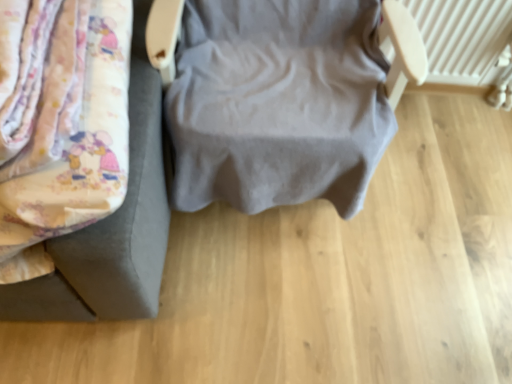
Question: From the image's perspective, is gray fabric chair at center, which is counted as the second furniture, starting from the left, located beneath fluffy fabric bed at left, which is the first furniture in left-to-right order?

Choices:
 (A) yes
 (B) no

Answer: (B)

Question: Considering the relative sizes of gray fabric chair at center, which is counted as the second furniture, starting from the left, and fluffy fabric bed at left, which is the first furniture in left-to-right order, in the image provided, is gray fabric chair at center, which is counted as the second furniture, starting from the left, wider than fluffy fabric bed at left, which is the first furniture in left-to-right order,?

Choices:
 (A) yes
 (B) no

Answer: (B)

Question: From the image's perspective, is gray fabric chair at center, which is the 1th furniture in right-to-left order, on top of fluffy fabric bed at left, which is the first furniture in left-to-right order?

Choices:
 (A) no
 (B) yes

Answer: (B)

Question: Does gray fabric chair at center, which is the 1th furniture in right-to-left order, have a lesser width compared to fluffy fabric bed at left, acting as the 2th furniture starting from the right?

Choices:
 (A) yes
 (B) no

Answer: (A)

Question: Can you confirm if gray fabric chair at center, which is counted as the second furniture, starting from the left, is smaller than fluffy fabric bed at left, which is the first furniture in left-to-right order?

Choices:
 (A) yes
 (B) no

Answer: (B)

Question: Is gray fabric chair at center, which is the 1th furniture in right-to-left order, outside of fluffy fabric bed at left, acting as the 2th furniture starting from the right?

Choices:
 (A) no
 (B) yes

Answer: (B)

Question: Considering the relative sizes of white textured radiator at upper right and gray fabric chair at center, which is counted as the second furniture, starting from the left, in the image provided, is white textured radiator at upper right bigger than gray fabric chair at center, which is counted as the second furniture, starting from the left,?

Choices:
 (A) yes
 (B) no

Answer: (B)

Question: Is the depth of white textured radiator at upper right less than that of gray fabric chair at center, which is counted as the second furniture, starting from the left?

Choices:
 (A) yes
 (B) no

Answer: (B)

Question: Does white textured radiator at upper right have a lesser height compared to gray fabric chair at center, which is the 1th furniture in right-to-left order?

Choices:
 (A) yes
 (B) no

Answer: (A)

Question: From the image's perspective, would you say white textured radiator at upper right is positioned over gray fabric chair at center, which is the 1th furniture in right-to-left order?

Choices:
 (A) no
 (B) yes

Answer: (B)

Question: Is gray fabric chair at center, which is counted as the second furniture, starting from the left, located within white textured radiator at upper right?

Choices:
 (A) no
 (B) yes

Answer: (A)

Question: Is white textured radiator at upper right behind gray fabric chair at center, which is the 1th furniture in right-to-left order?

Choices:
 (A) no
 (B) yes

Answer: (B)

Question: Is fluffy fabric bed at left, acting as the 2th furniture starting from the right, at the left side of gray fabric chair at center, which is counted as the second furniture, starting from the left?

Choices:
 (A) yes
 (B) no

Answer: (A)